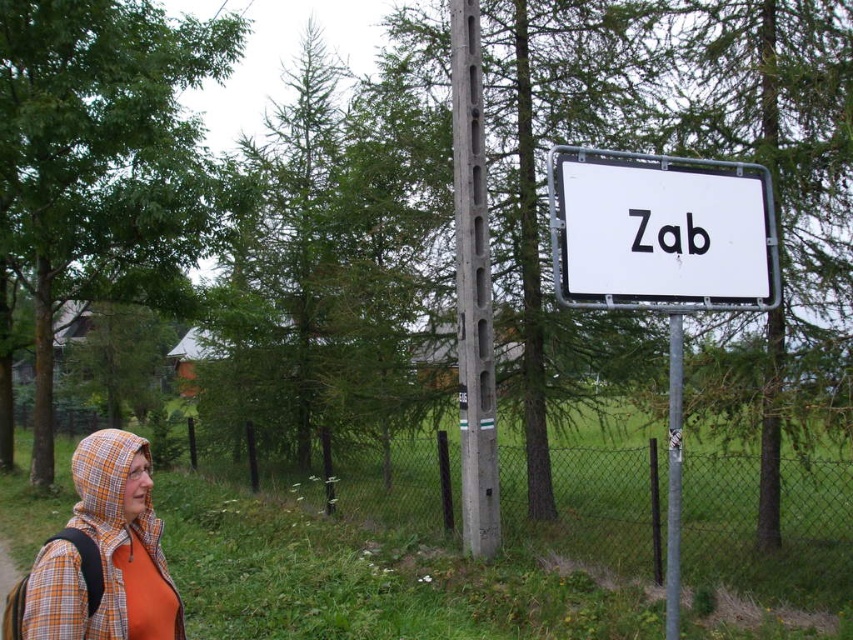
Which is in front, point (709, 288) or point (120, 554)?

Point (120, 554)

Who is more distant from viewer, (706,170) or (33,592)?

Point (706,170)

This screenshot has width=853, height=640. I want to click on white plastic sign at center, so click(660, 230).

Does white metal sign at center right have a smaller size compared to white plastic sign at center?

Actually, white metal sign at center right might be larger than white plastic sign at center.

This screenshot has height=640, width=853. Identify the location of white metal sign at center right. (662, 259).

What do you see at coordinates (662, 259) in the screenshot? I see `white metal sign at center right` at bounding box center [662, 259].

Can you confirm if white metal sign at center right is thinner than orange plaid hood at left?

Incorrect, white metal sign at center right's width is not less than orange plaid hood at left's.

Is point (640, 216) closer to viewer compared to point (144, 616)?

No, it is behind (144, 616).

Find the location of a particular element. The height and width of the screenshot is (640, 853). white metal sign at center right is located at coordinates (662, 259).